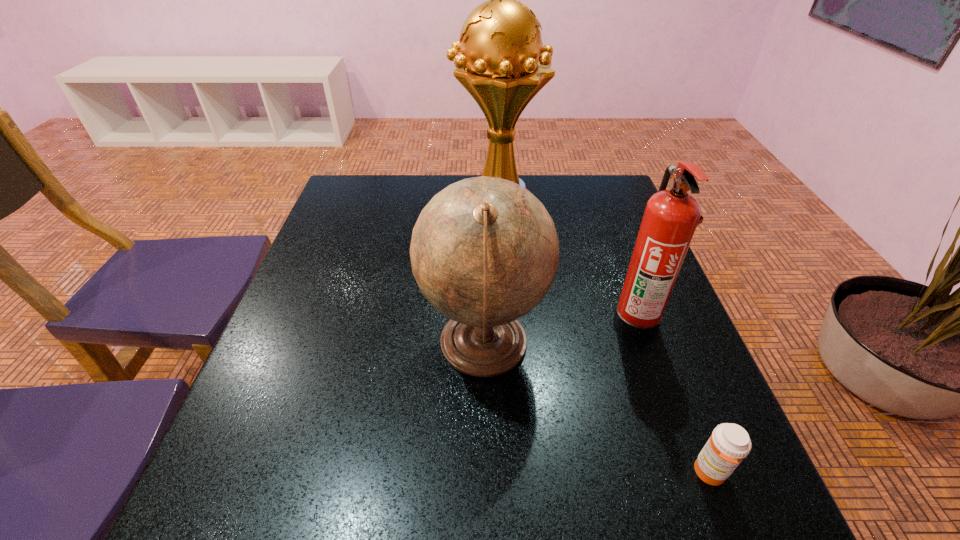
What are the coordinates of `object at the near right corner` in the screenshot? It's located at (729, 444).

The height and width of the screenshot is (540, 960). In order to click on vacant space at the far edge in this screenshot , I will do `click(435, 182)`.

The height and width of the screenshot is (540, 960). In order to click on free space at the left edge in this screenshot , I will do `click(260, 384)`.

What are the coordinates of `vacant space at the right edge of the desktop` in the screenshot? It's located at (603, 251).

You are a GUI agent. You are given a task and a screenshot of the screen. Output one action in this format:
    pyautogui.click(x=<x>, y=<y>)
    Task: Click on the blank space at the near left corner
    
    Given the screenshot: What is the action you would take?
    pyautogui.click(x=283, y=505)

This screenshot has width=960, height=540. I want to click on free space at the far right corner of the desktop, so click(x=567, y=180).

At what (x,y) coordinates should I click in order to perform the action: click on free space between the trophy_cup and the medicine. Please return your answer as a coordinate pair (x, y). The width and height of the screenshot is (960, 540). Looking at the image, I should click on (604, 335).

The height and width of the screenshot is (540, 960). In order to click on vacant space that is in between the farthest object and the shortest object in this screenshot , I will do `click(604, 335)`.

Find the location of a particular element. This screenshot has height=540, width=960. vacant space that is in between the nearest object and the tallest object is located at coordinates (604, 335).

Identify the location of free spot between the shortest object and the globe. (597, 409).